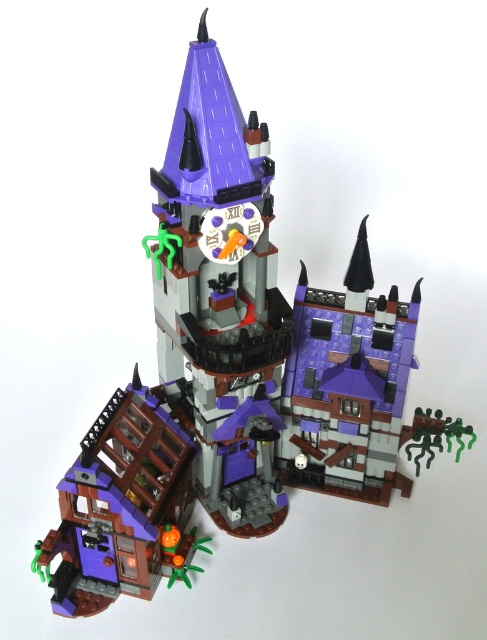
Which is below, purple matte clock tower at center or matte purple house at lower left?

matte purple house at lower left is below.

Between purple matte clock tower at center and matte purple house at lower left, which one is positioned higher?

purple matte clock tower at center is higher up.

Is point (225, 346) positioned behind point (150, 596)?

That is False.

Locate an element on the screen. This screenshot has height=640, width=487. purple matte clock tower at center is located at coordinates click(x=221, y=296).